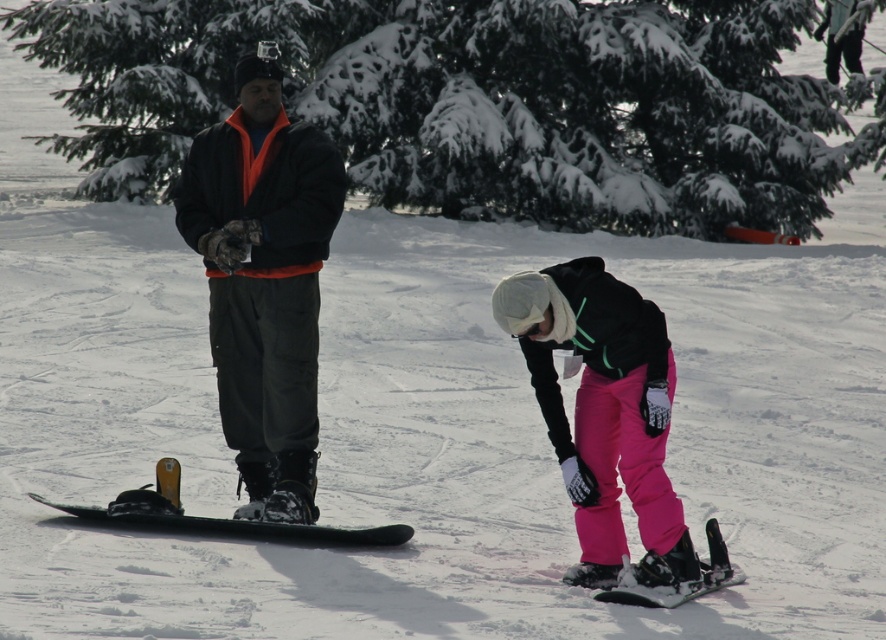
Question: Can you confirm if green textured pine tree at upper center is positioned to the left of matte black snowboard at left?

Choices:
 (A) no
 (B) yes

Answer: (A)

Question: Can you confirm if black matte snowboard at center is wider than green matte snowboard at center?

Choices:
 (A) no
 (B) yes

Answer: (A)

Question: Is black matte snowboard at center above green matte snowboard at center?

Choices:
 (A) no
 (B) yes

Answer: (B)

Question: Which point is closer to the camera?

Choices:
 (A) black matte snowboard at center
 (B) matte pink pants at lower center
 (C) black matte snowboard at lower center

Answer: (C)

Question: Among these points, which one is farthest from the camera?

Choices:
 (A) (313, 323)
 (B) (721, 576)

Answer: (A)

Question: Estimate the real-world distances between objects in this image. Which object is farther from the matte pink pants at lower center?

Choices:
 (A) green textured pine tree at upper center
 (B) matte black snowboard at left
 (C) black matte snowboard at lower center
 (D) black matte snowboard at center

Answer: (A)